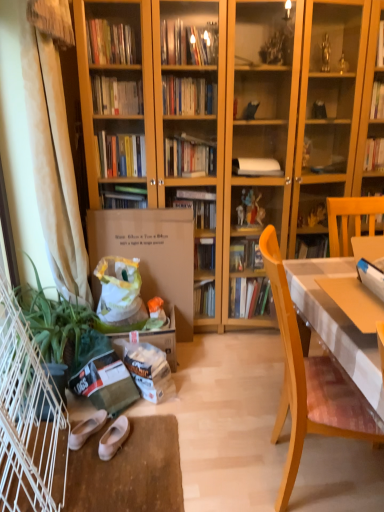
Question: Does green leafy plant at lower left have a greater width compared to white cloth-covered desk at right?

Choices:
 (A) yes
 (B) no

Answer: (B)

Question: Considering the relative positions of green leafy plant at lower left and white cloth-covered desk at right in the image provided, is green leafy plant at lower left in front of white cloth-covered desk at right?

Choices:
 (A) no
 (B) yes

Answer: (A)

Question: Considering the relative sizes of green leafy plant at lower left and white cloth-covered desk at right in the image provided, is green leafy plant at lower left bigger than white cloth-covered desk at right?

Choices:
 (A) no
 (B) yes

Answer: (B)

Question: From the image's perspective, does green leafy plant at lower left appear higher than white cloth-covered desk at right?

Choices:
 (A) yes
 (B) no

Answer: (B)

Question: Is green leafy plant at lower left next to white cloth-covered desk at right?

Choices:
 (A) no
 (B) yes

Answer: (A)

Question: Would you say wooden chair at right is inside or outside white suede shoes at lower left, marked as the 2th footwear in a right-to-left arrangement?

Choices:
 (A) outside
 (B) inside

Answer: (A)

Question: Relative to white suede shoes at lower left, marked as the 2th footwear in a right-to-left arrangement, is wooden chair at right in front or behind?

Choices:
 (A) behind
 (B) front

Answer: (B)

Question: Based on their sizes in the image, would you say wooden chair at right is bigger or smaller than white suede shoes at lower left, the 1th footwear in the left-to-right sequence?

Choices:
 (A) small
 (B) big

Answer: (B)

Question: From the image's perspective, is wooden chair at right positioned above or below white suede shoes at lower left, marked as the 2th footwear in a right-to-left arrangement?

Choices:
 (A) above
 (B) below

Answer: (A)

Question: From a real-world perspective, is wooden chair at right above or below white cloth-covered desk at right?

Choices:
 (A) below
 (B) above

Answer: (A)

Question: Is wooden chair at right situated inside white cloth-covered desk at right or outside?

Choices:
 (A) inside
 (B) outside

Answer: (B)

Question: Relative to white cloth-covered desk at right, is wooden chair at right in front or behind?

Choices:
 (A) behind
 (B) front

Answer: (A)

Question: In the image, is wooden chair at right on the left side or the right side of white cloth-covered desk at right?

Choices:
 (A) right
 (B) left

Answer: (B)

Question: Is point (64, 266) closer or farther from the camera than point (23, 322)?

Choices:
 (A) farther
 (B) closer

Answer: (A)

Question: From a real-world perspective, is white fabric curtain at left physically located above or below green leafy plant at lower left?

Choices:
 (A) below
 (B) above

Answer: (B)